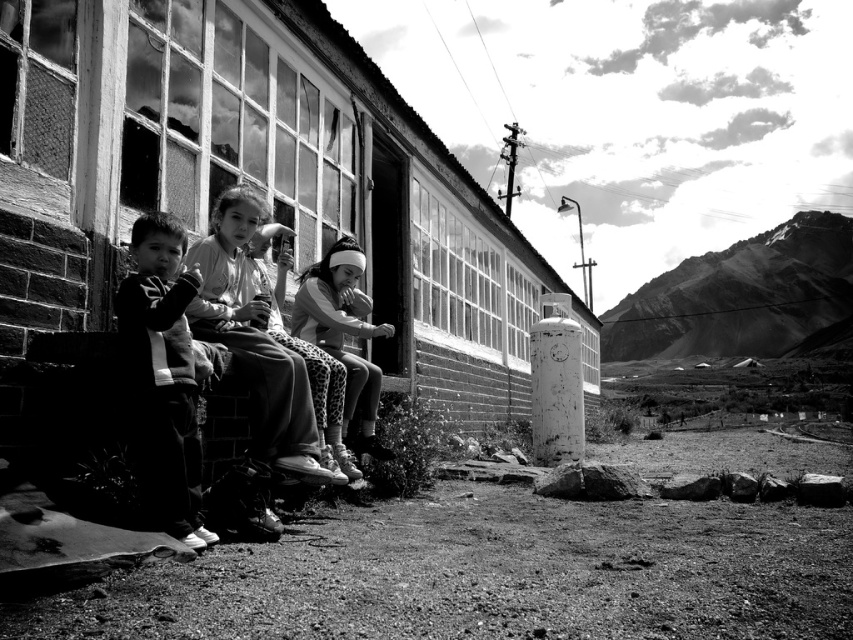
Is point (161, 524) positioned in front of point (332, 381)?

Yes, it is.

Between dark clothing at left and white fabric headband at center, which one appears on the left side from the viewer's perspective?

dark clothing at left

Locate an element on the screen. The height and width of the screenshot is (640, 853). dark clothing at left is located at coordinates point(163,372).

Find the location of a particular element. This screenshot has width=853, height=640. dark clothing at left is located at coordinates (163, 372).